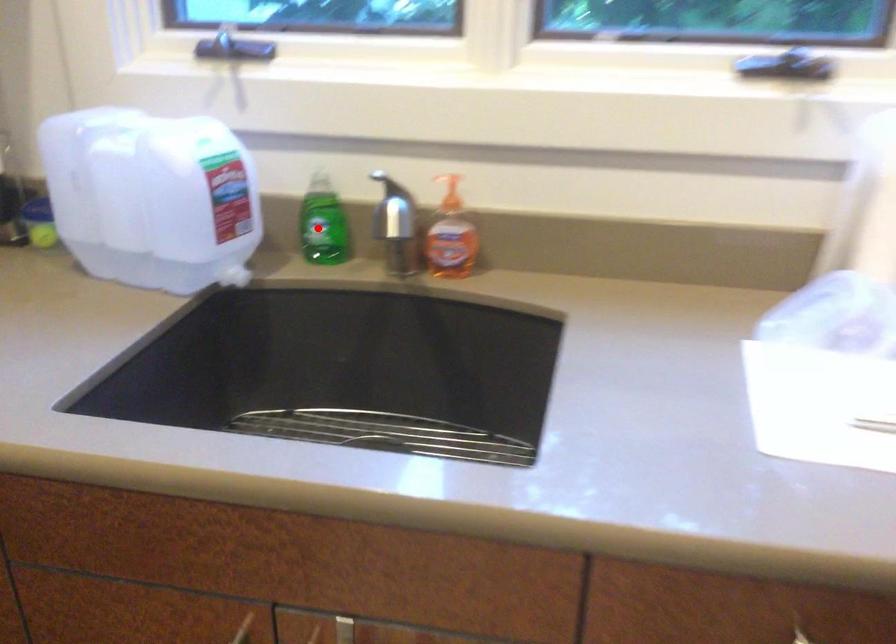
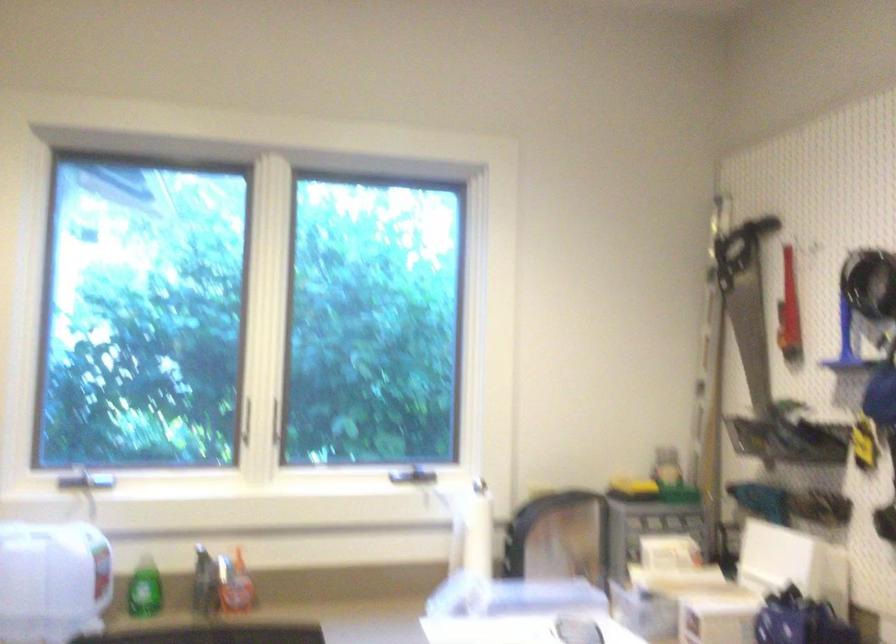
Locate, in the second image, the point that corresponds to the highlighted location in the first image.

(143, 589)